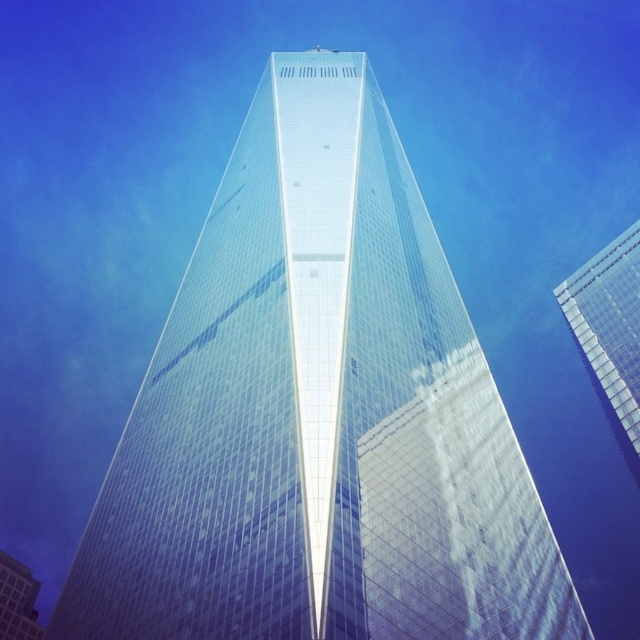
Question: From the image, what is the correct spatial relationship of transparent glass skyscraper at right in relation to transparent glass skyscraper at center?

Choices:
 (A) below
 (B) above

Answer: (B)

Question: Which point is closer to the camera taking this photo?

Choices:
 (A) (634, 305)
 (B) (1, 589)

Answer: (A)

Question: Which point appears farthest from the camera in this image?

Choices:
 (A) (26, 568)
 (B) (588, 308)

Answer: (A)

Question: Does transparent glass skyscraper at right lie in front of transparent glass skyscraper at center?

Choices:
 (A) yes
 (B) no

Answer: (A)

Question: Is transparent glass skyscraper at right to the right of transparent glass skyscraper at center from the viewer's perspective?

Choices:
 (A) no
 (B) yes

Answer: (B)